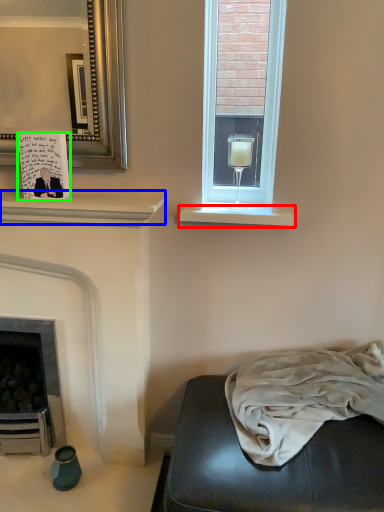
Question: Which object is positioned farthest from window sill (highlighted by a red box)? Select from mantle (highlighted by a blue box) and postcard (highlighted by a green box).

Choices:
 (A) mantle
 (B) postcard

Answer: (B)